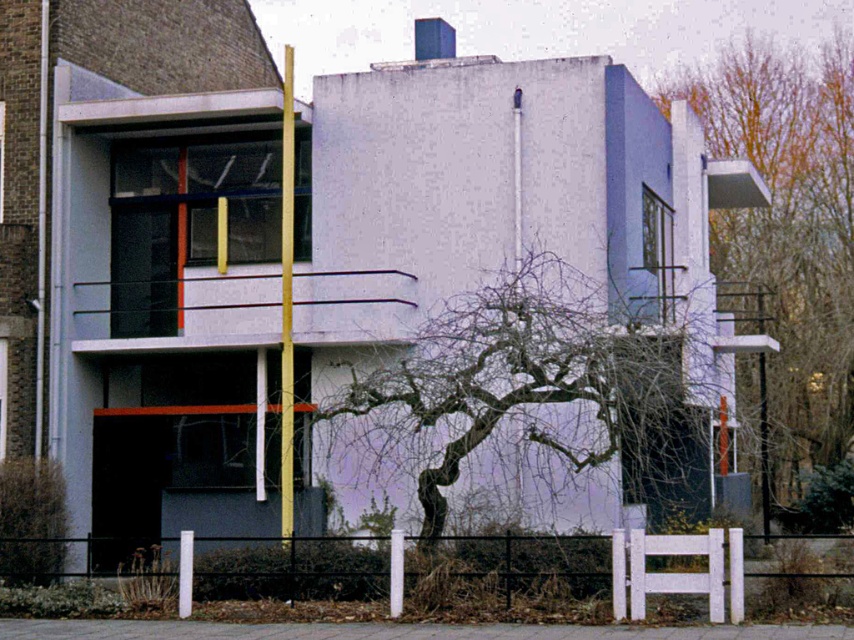
Is bare branches at center taller than white painted wood fence at lower center?

Correct, bare branches at center is much taller as white painted wood fence at lower center.

Does bare branches at center have a smaller size compared to white painted wood fence at lower center?

No, bare branches at center is not smaller than white painted wood fence at lower center.

What do you see at coordinates (534, 387) in the screenshot? Image resolution: width=854 pixels, height=640 pixels. I see `bare branches at center` at bounding box center [534, 387].

Find the location of a particular element. The image size is (854, 640). bare branches at center is located at coordinates (534, 387).

Is point (799, 445) positioned in front of point (688, 534)?

No, it is not.

This screenshot has height=640, width=854. In order to click on bare branches at upper right in this screenshot , I will do 787,240.

Identify the location of bare branches at upper right. (787, 240).

Can you confirm if bare branches at center is positioned above bare branches at upper right?

Actually, bare branches at center is below bare branches at upper right.

Image resolution: width=854 pixels, height=640 pixels. I want to click on bare branches at center, so click(x=534, y=387).